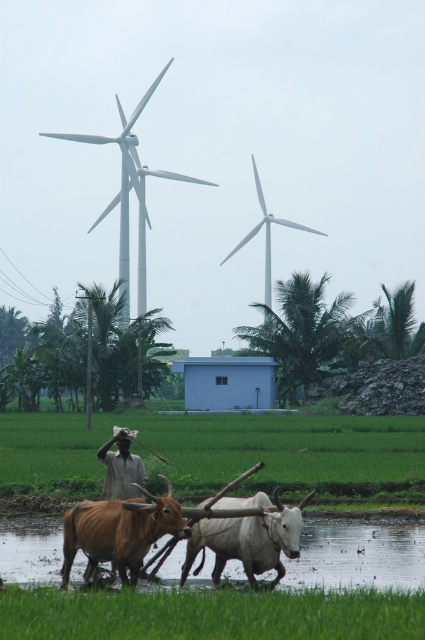
Is white glossy bull at center below light brown cotton shirt at center?

Correct, white glossy bull at center is located below light brown cotton shirt at center.

Does white glossy bull at center have a lesser width compared to light brown cotton shirt at center?

Indeed, white glossy bull at center has a lesser width compared to light brown cotton shirt at center.

This screenshot has width=425, height=640. I want to click on white glossy bull at center, so click(x=249, y=540).

The image size is (425, 640). I want to click on white glossy bull at center, so click(249, 540).

Is brown muddy water at lower center taller than white matte windmill at upper center?

No, brown muddy water at lower center is not taller than white matte windmill at upper center.

Is point (61, 529) farther from viewer compared to point (142, 268)?

No.

Where is `brown muddy water at lower center`? The width and height of the screenshot is (425, 640). brown muddy water at lower center is located at coordinates 357,554.

From the picture: Who is shorter, white glossy bull at center or white matte windmill at upper center?

Standing shorter between the two is white glossy bull at center.

Is white glossy bull at center closer to camera compared to white matte windmill at upper center?

Yes, white glossy bull at center is closer to the viewer.

At what (x,y) coordinates should I click in order to perform the action: click on white glossy bull at center. Please return your answer as a coordinate pair (x, y). The height and width of the screenshot is (640, 425). Looking at the image, I should click on (249, 540).